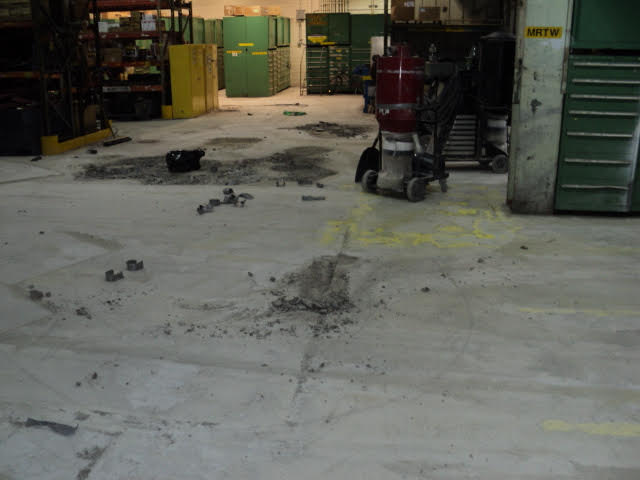
Where is `storage`? The image size is (640, 480). storage is located at coordinates (249, 54), (340, 37), (369, 31), (203, 29), (193, 70), (214, 77), (598, 91).